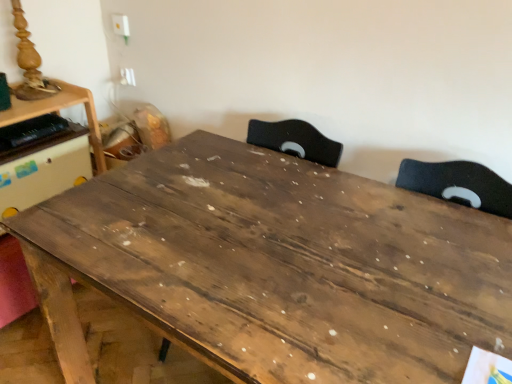
Question: Based on their sizes in the image, would you say wooden table at center, arranged as the first table when viewed from the right, is bigger or smaller than wooden table at left, the first table in the left-to-right sequence?

Choices:
 (A) big
 (B) small

Answer: (A)

Question: From a real-world perspective, is wooden table at center, arranged as the first table when viewed from the right, above or below wooden table at left, the second table positioned from the right?

Choices:
 (A) above
 (B) below

Answer: (B)

Question: In the image, is wooden table at center, arranged as the first table when viewed from the right, on the left side or the right side of wooden table at left, the first table in the left-to-right sequence?

Choices:
 (A) left
 (B) right

Answer: (B)

Question: From the image's perspective, is wooden table at left, the first table in the left-to-right sequence, above or below wooden table at center, arranged as the first table when viewed from the right?

Choices:
 (A) below
 (B) above

Answer: (B)

Question: Considering the positions of point (11, 100) and point (250, 163), is point (11, 100) closer or farther from the camera than point (250, 163)?

Choices:
 (A) farther
 (B) closer

Answer: (A)

Question: Looking at their shapes, would you say wooden table at left, the second table positioned from the right, is wider or thinner than wooden table at center, arranged as the first table when viewed from the right?

Choices:
 (A) thin
 (B) wide

Answer: (A)

Question: Relative to wooden table at center, acting as the second table starting from the left, is wooden table at left, the first table in the left-to-right sequence, in front or behind?

Choices:
 (A) front
 (B) behind

Answer: (B)